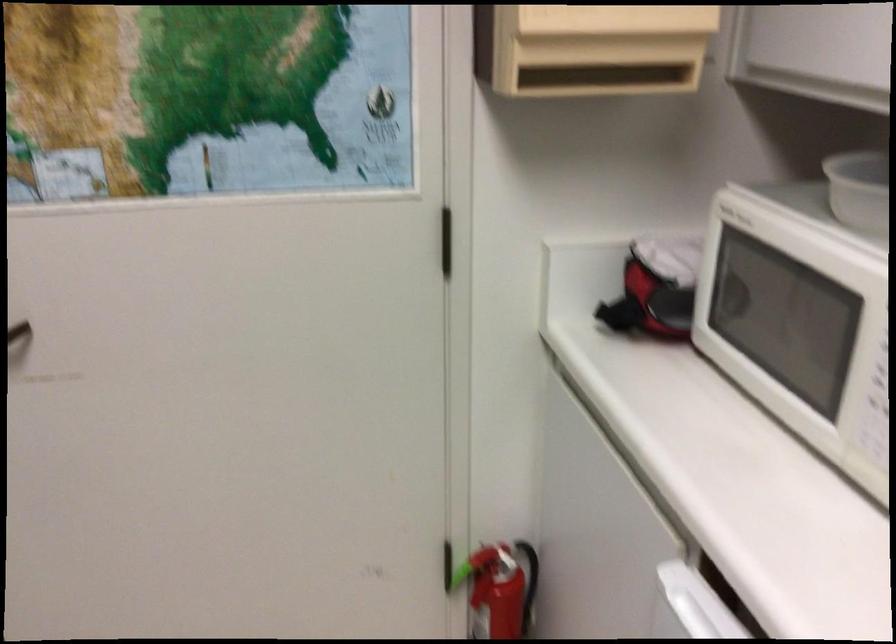
Locate an element on the screen. The width and height of the screenshot is (896, 644). black door handle is located at coordinates click(x=19, y=341).